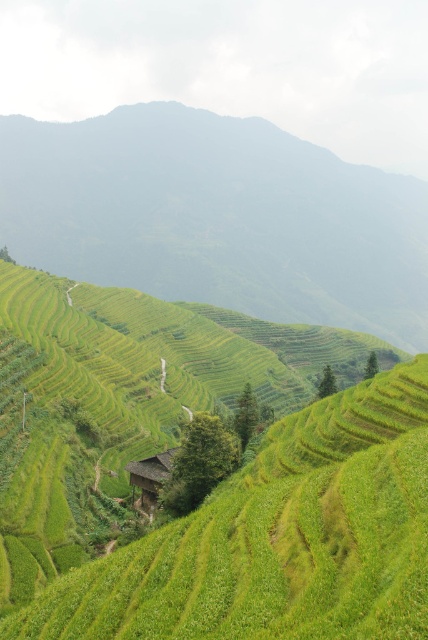
You are standing at the viewpoint overlooking the terraced rice fields. You notice two points marked on the image. Which point is closer to you, point [282,228] or point [157,467]?

Result: Point [157,467] is closer to you because the Objects Description states that point [282,228] is behind point [157,467].

You are a hiker standing at the bottom of the green grassy hillside at center and want to reach the brown wooden hut at center. Which direction should you go to get there?

The brown wooden hut at center is behind the green grassy hillside at center, so you should go forward towards the hillside to reach it.

You are standing at the point labeled point (217, 218) in the terraced rice fields. What do you see directly below you?

You are standing on the green grassy hillside at center, so directly below you would be the green grassy hillside at center itself.